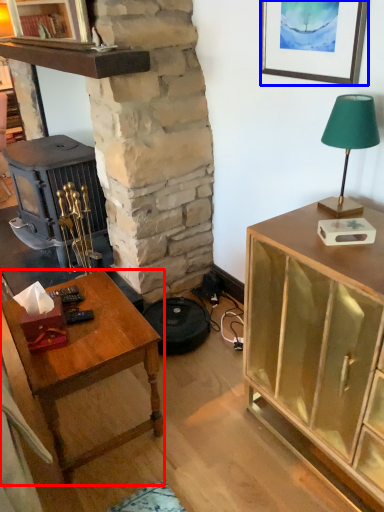
Question: Which object appears closest to the camera in this image, desk (highlighted by a red box) or picture frame (highlighted by a blue box)?

Choices:
 (A) desk
 (B) picture frame

Answer: (A)